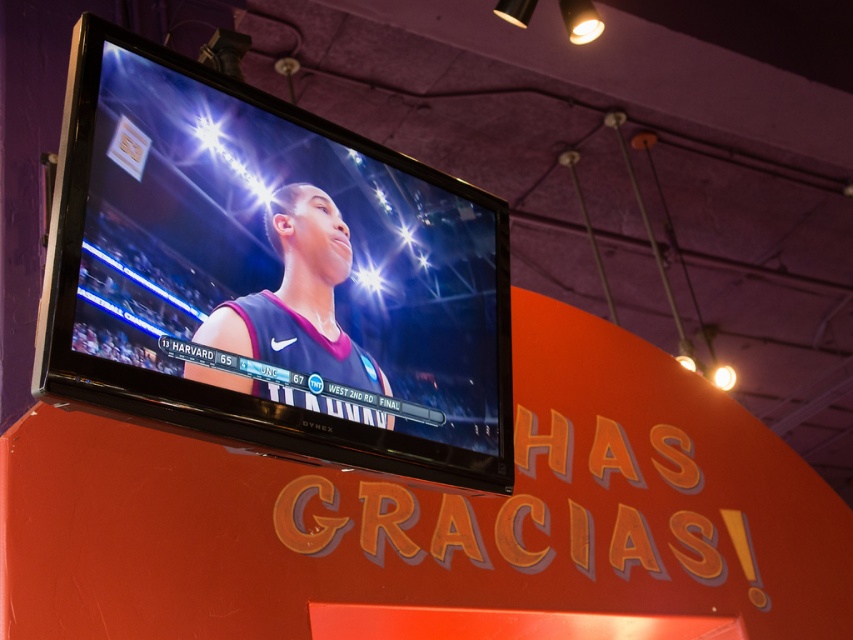
Question: Which of the following is the closest to the observer?

Choices:
 (A) (231, 316)
 (B) (231, 384)

Answer: (B)

Question: Which point is farther to the camera?

Choices:
 (A) (308, 236)
 (B) (114, 156)

Answer: (A)

Question: In this image, where is matte black tv at upper center located relative to matte black jersey at center?

Choices:
 (A) above
 (B) below

Answer: (A)

Question: Observing the image, what is the correct spatial positioning of matte black tv at upper center in reference to matte black jersey at center?

Choices:
 (A) right
 (B) left

Answer: (A)

Question: In this image, where is matte black tv at upper center located relative to matte black jersey at center?

Choices:
 (A) right
 (B) left

Answer: (A)